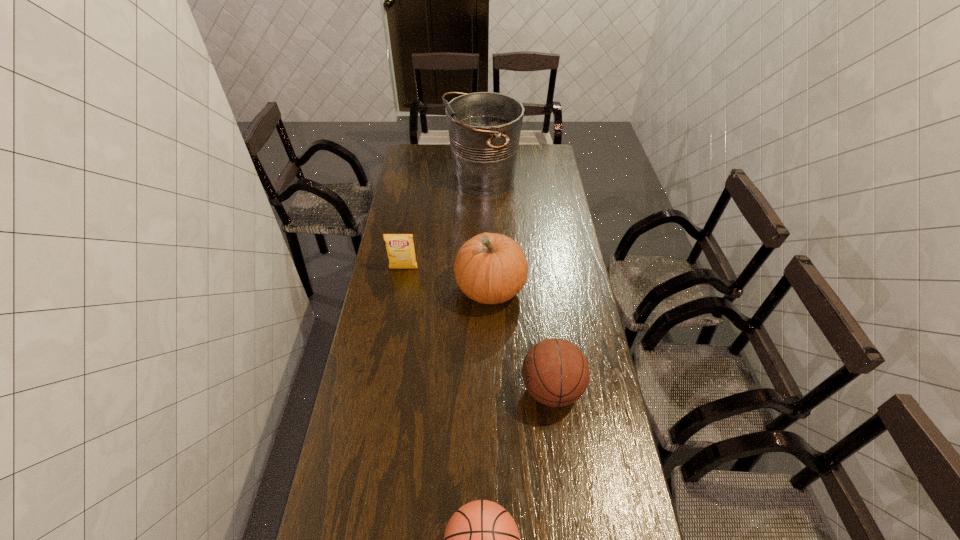
Locate an element on the screen. This screenshot has height=540, width=960. free spot between the leftmost object and the fourth shortest object is located at coordinates (447, 279).

In order to click on vacant point located between the leftmost object and the farther basketball in this screenshot , I will do `click(478, 329)`.

The image size is (960, 540). I want to click on free space between the farther basketball and the leftmost object, so click(x=478, y=329).

Where is `free space between the farthest object and the leftmost object`? free space between the farthest object and the leftmost object is located at coordinates (444, 224).

The height and width of the screenshot is (540, 960). Find the location of `vacant space in between the leftmost object and the right basketball`. vacant space in between the leftmost object and the right basketball is located at coordinates (478, 329).

The image size is (960, 540). Identify the location of object that can be found as the fourth closest to the leftmost object. (481, 539).

Select which object appears as the fourth closest to the second tallest object. Please provide its 2D coordinates. Your answer should be formatted as a tuple, i.e. [(x, y)], where the tuple contains the x and y coordinates of a point satisfying the conditions above.

[(481, 539)]